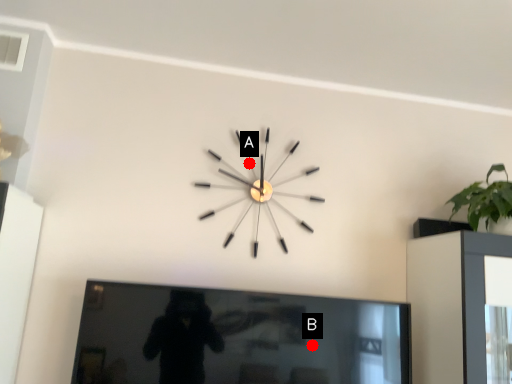
Question: Two points are circled on the image, labeled by A and B beside each circle. Which point is farther from the camera taking this photo?

Choices:
 (A) A is further
 (B) B is further

Answer: (A)